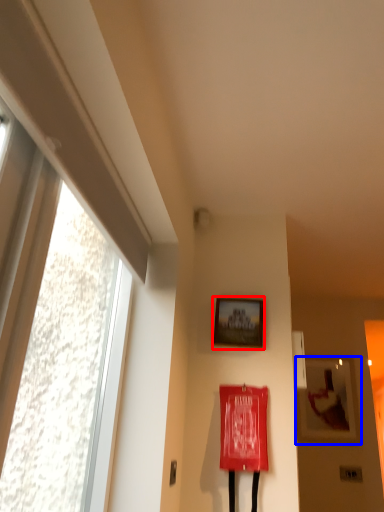
Question: Which point is further to the camera, picture frame (highlighted by a red box) or picture frame (highlighted by a blue box)?

Choices:
 (A) picture frame
 (B) picture frame

Answer: (B)